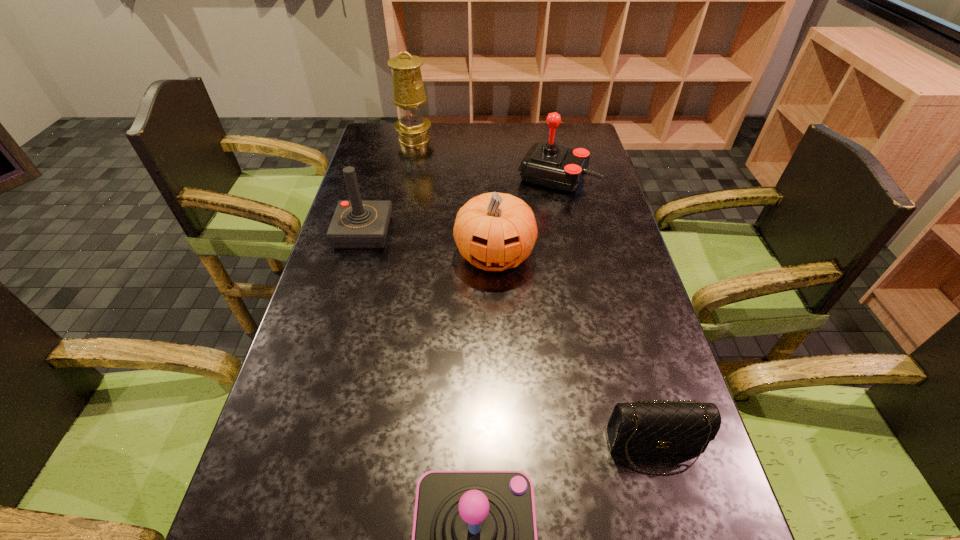
Where is `the tallest object`? The image size is (960, 540). the tallest object is located at coordinates (408, 90).

Image resolution: width=960 pixels, height=540 pixels. Identify the location of oil lamp. (408, 90).

Where is `the fifth nearest object`? the fifth nearest object is located at coordinates (547, 164).

This screenshot has height=540, width=960. I want to click on the rightmost joystick, so click(x=547, y=164).

Locate an element on the screen. The image size is (960, 540). the leftmost joystick is located at coordinates (356, 224).

Image resolution: width=960 pixels, height=540 pixels. What are the coordinates of `pumpkin` in the screenshot? It's located at [x=494, y=231].

You are a GUI agent. You are given a task and a screenshot of the screen. Output one action in this format:
    pyautogui.click(x=<x>, y=<y>)
    Task: Click on the clutch bag
    
    Given the screenshot: What is the action you would take?
    pyautogui.click(x=648, y=427)

I want to click on vacant space situated 0.170m on the front of the oil lamp, so click(x=407, y=174).

Where is `vacant region located on the left of the farthest joystick`? vacant region located on the left of the farthest joystick is located at coordinates (499, 177).

Where is `vacant area situated on the rectangular base of the second nearest joystick`? Image resolution: width=960 pixels, height=540 pixels. vacant area situated on the rectangular base of the second nearest joystick is located at coordinates (343, 307).